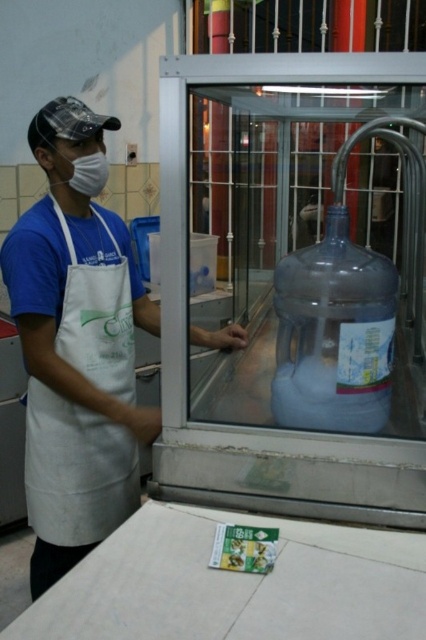
You are a customer at this shop and want to grab the transparent plastic bottle at center. Can you reach it without moving from your current position?

The transparent plastic bottle at center is 1.21 meters from viewer, so yes, you can reach it without moving from your current position.

Looking at this image, you are a customer observing the person behind the counter. Which item is taller between the white apron at left and the white matte mask at left?

The white apron at left is taller than the white matte mask at left.